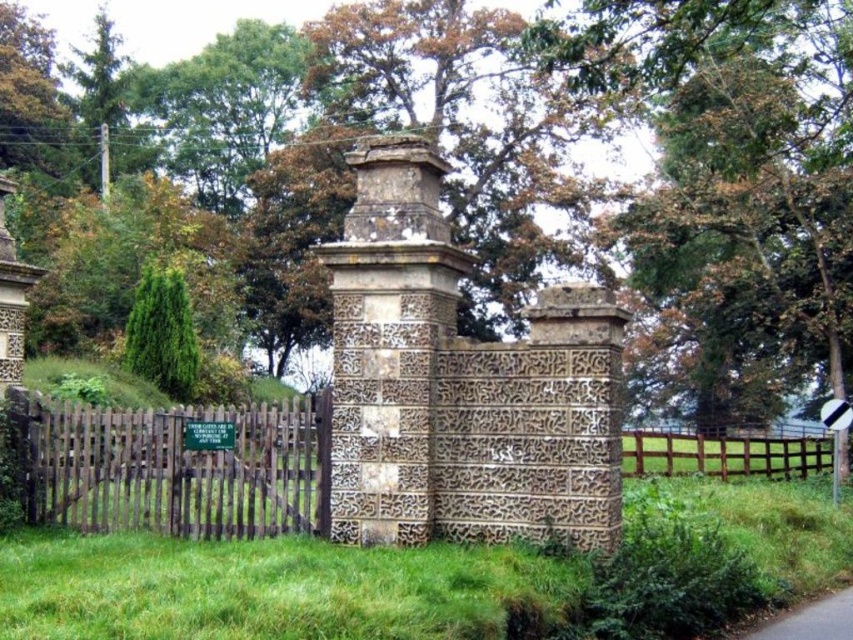
Question: Can you confirm if brown wooden fence at center is smaller than brown wooden fence at left?

Choices:
 (A) yes
 (B) no

Answer: (B)

Question: Which point is closer to the camera taking this photo?

Choices:
 (A) (395, 292)
 (B) (292, 102)
 (C) (70, 497)

Answer: (A)

Question: Estimate the real-world distances between objects in this image. Which object is closer to the brown wooden fence at left?

Choices:
 (A) gray asphalt road at lower right
 (B) carved stone pillar at center
 (C) green leafy tree at upper center
 (D) brown wooden fence at center

Answer: (B)

Question: Can you confirm if brown wooden fence at center is positioned below green leafy tree at upper center?

Choices:
 (A) no
 (B) yes

Answer: (B)

Question: Which object is closer to the camera taking this photo?

Choices:
 (A) carved stone pillar at center
 (B) brown wooden fence at center
 (C) green leafy tree at upper center
 (D) brown wooden fence at left

Answer: (A)

Question: Does brown wooden fence at left have a lesser width compared to gray asphalt road at lower right?

Choices:
 (A) yes
 (B) no

Answer: (B)